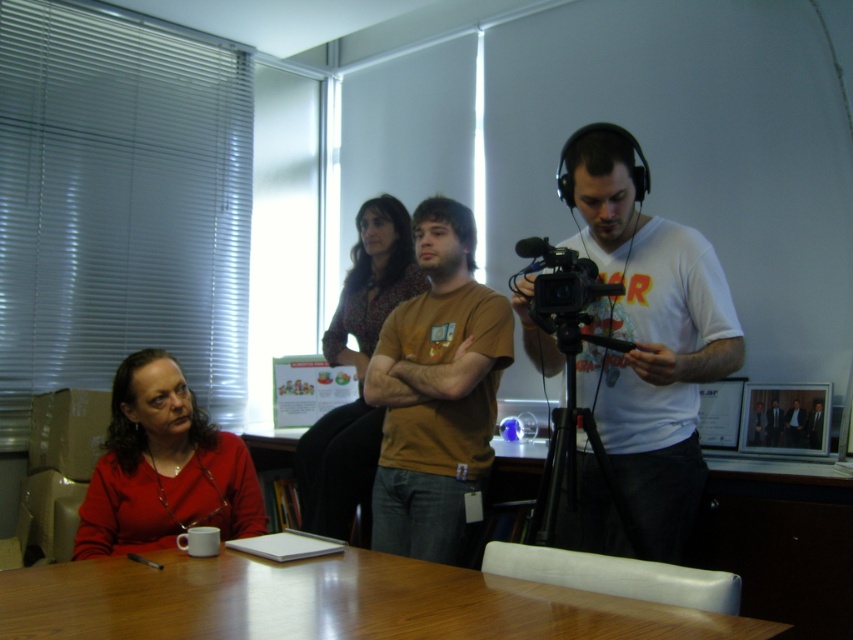
You are standing in the room and want to place a small object on the table near both point (544,340) and point (316,467). Which point is closer to you when looking at the table?

Point (544,340) is closer to the camera than point (316,467), so it is closer to you when looking at the table.

You are setting up equipment for a video call. You have a white matte camera at center and a black metal tripod at center. Which one has a larger width?

The white matte camera at center is wider than the black metal tripod at center according to the description.